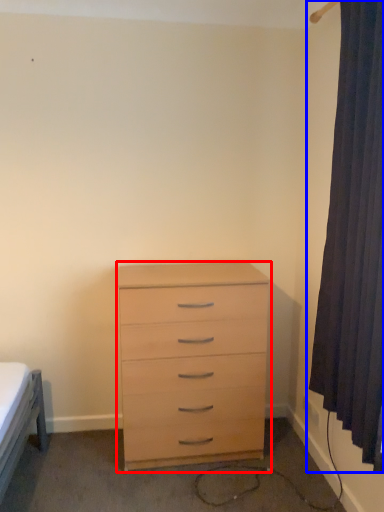
Question: Which point is further to the camera, chest of drawers (highlighted by a red box) or curtain (highlighted by a blue box)?

Choices:
 (A) chest of drawers
 (B) curtain

Answer: (A)